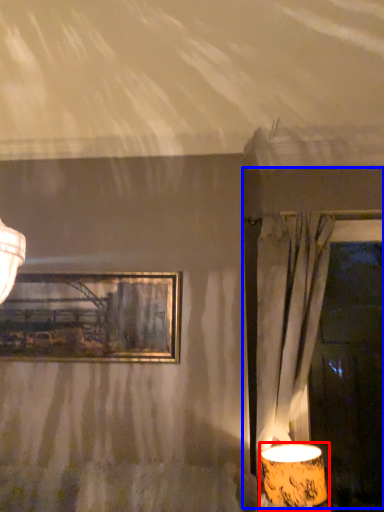
Question: Which object appears closest to the camera in this image, lamp (highlighted by a red box) or window frame (highlighted by a blue box)?

Choices:
 (A) lamp
 (B) window frame

Answer: (A)